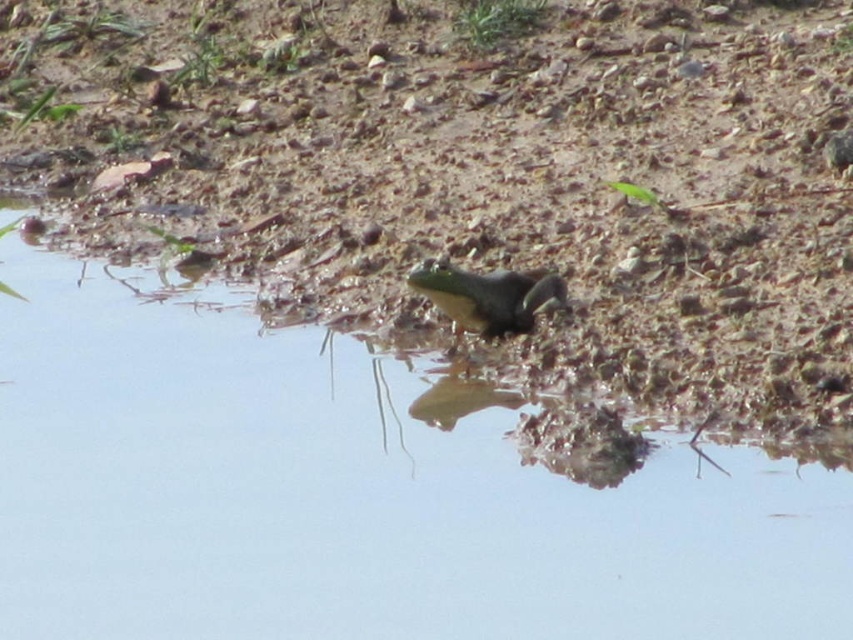
Looking at this image, which of these two, green matte frog at center or green matte lizard at center, stands shorter?

With less height is green matte lizard at center.

Who is lower down, green matte frog at center or green matte lizard at center?

green matte frog at center

Between point (387, 465) and point (473, 326), which one is positioned in front?

Point (387, 465)

What are the coordinates of `green matte frog at center` in the screenshot? It's located at (354, 492).

Does dull brown dirt at center have a greater height compared to green matte lizard at center?

Indeed, dull brown dirt at center has a greater height compared to green matte lizard at center.

Image resolution: width=853 pixels, height=640 pixels. What do you see at coordinates (479, 172) in the screenshot?
I see `dull brown dirt at center` at bounding box center [479, 172].

Locate an element on the screen. The width and height of the screenshot is (853, 640). dull brown dirt at center is located at coordinates (479, 172).

From the picture: Who is positioned more to the left, dull brown dirt at center or green matte frog at center?

From the viewer's perspective, green matte frog at center appears more on the left side.

Measure the distance between point (173, 152) and camera.

Point (173, 152) is 3.44 meters away from camera.

The width and height of the screenshot is (853, 640). In order to click on dull brown dirt at center in this screenshot , I will do `click(479, 172)`.